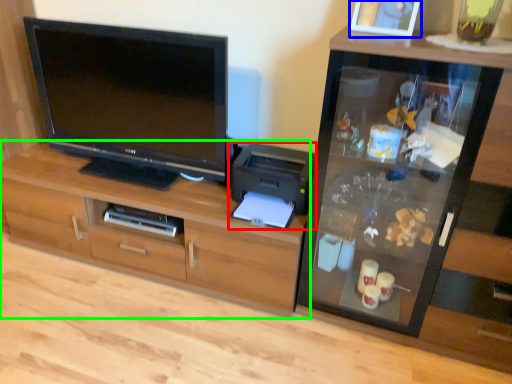
Question: Which object is the farthest from printer (highlighted by a red box)? Choose among these: picture frame (highlighted by a blue box) or cabinetry (highlighted by a green box).

Choices:
 (A) picture frame
 (B) cabinetry

Answer: (A)